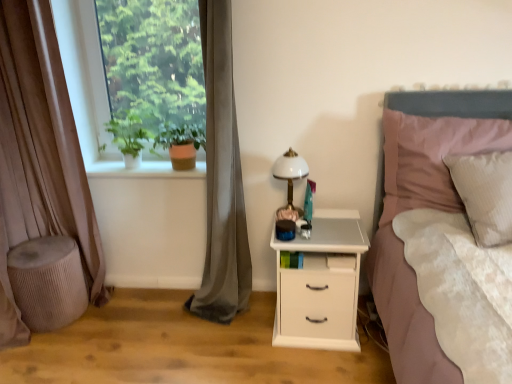
In order to click on blank space to the left of gray velvet curtain at left, positioned as the second curtain in left-to-right order in this screenshot , I will do `click(162, 314)`.